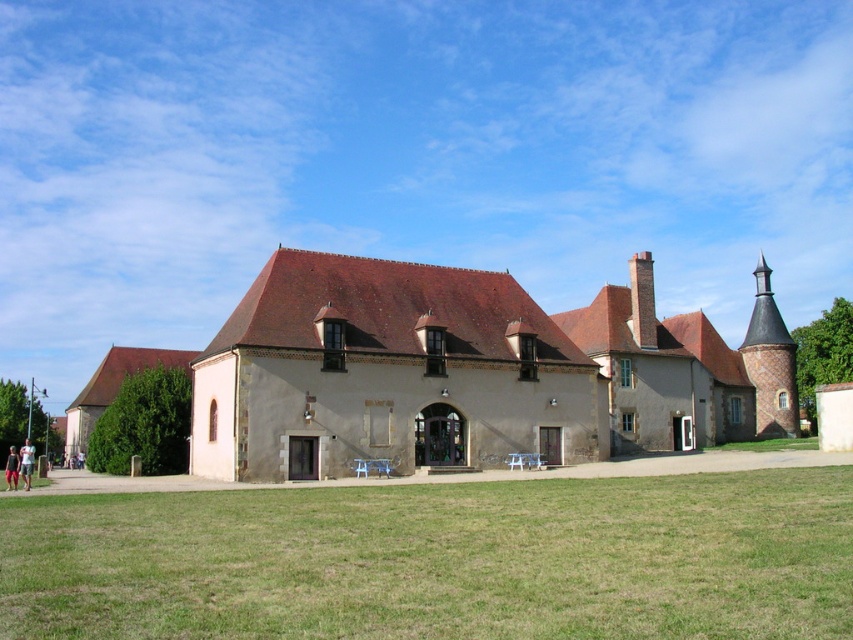
You are a drone operator trying to navigate between two brick chimneys on a building. The brown brick chimney at upper right and the brick chimney at center are both visible from your current position. Which chimney should you fly towards if you want to reach the one located more to the east?

The brown brick chimney at upper right is to the right of the brick chimney at center, so if you want to go east, you should fly towards the brown brick chimney at upper right since it is positioned further east compared to the brick chimney at center.

You are standing at the base of the cylindrical tower with a conical roof on the right side of the building. From your current position, in which direction should you walk to reach the green grass at lower center?

You should walk towards the lower center direction to reach the green grass at lower center, as it is located at point (439, 560) in the image.

You are a drone operator tasked with capturing aerial footage of the brown brick chimney at upper right and the brick chimney at center. The minimum safe distance between the drone and any structure is 50 meters. Can you fly the drone between these two chimneys without violating the safety guidelines?

The brown brick chimney at upper right is 72.23 meters from the brick chimney at center. Since the minimum safe distance is 50 meters, the drone can safely fly between them as the distance between the chimneys exceeds the required safety margin.